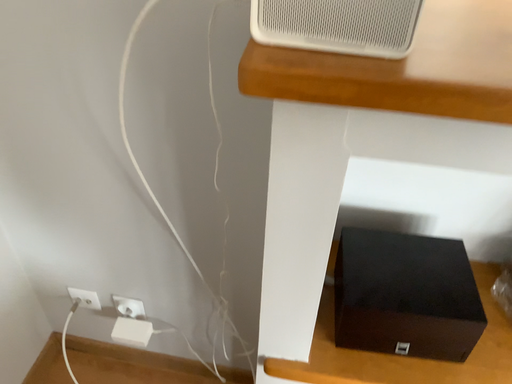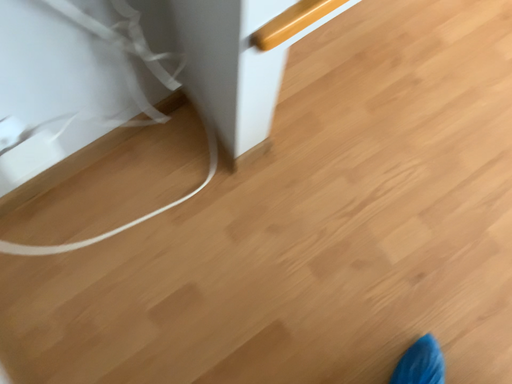
Question: Which way did the camera rotate in the video?

Choices:
 (A) rotated downward
 (B) rotated upward

Answer: (A)